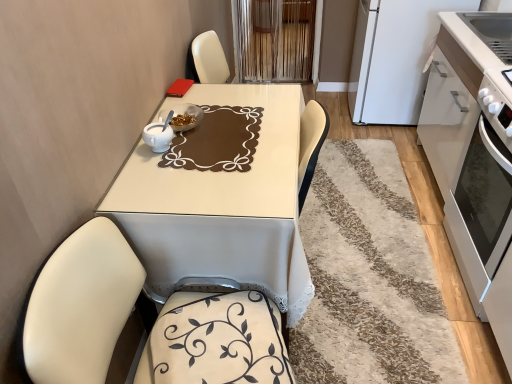
Find the location of `vacant space behind white glossy bowl at center`. vacant space behind white glossy bowl at center is located at coordinates (192, 105).